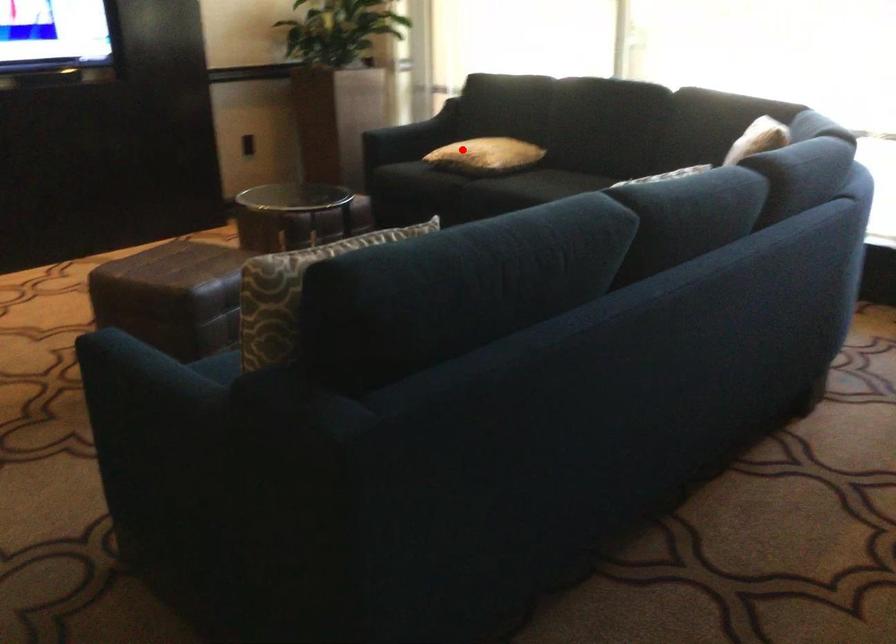
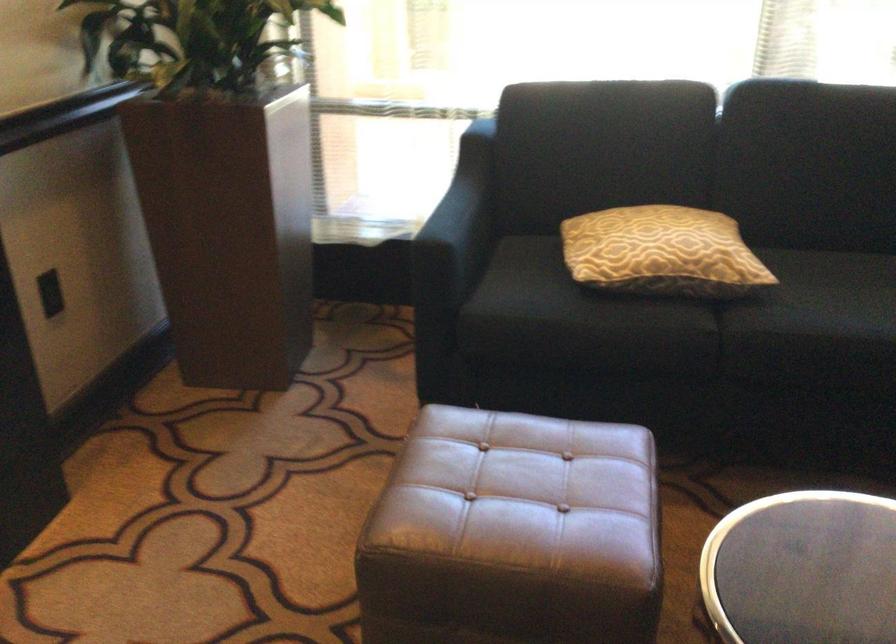
Find the pixel in the second image that matches the highlighted location in the first image.

(661, 252)